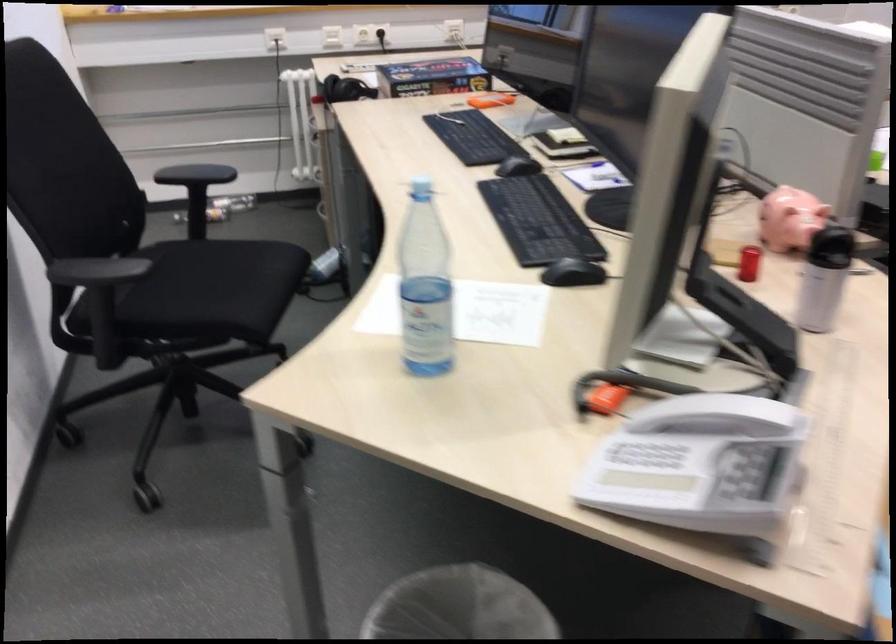
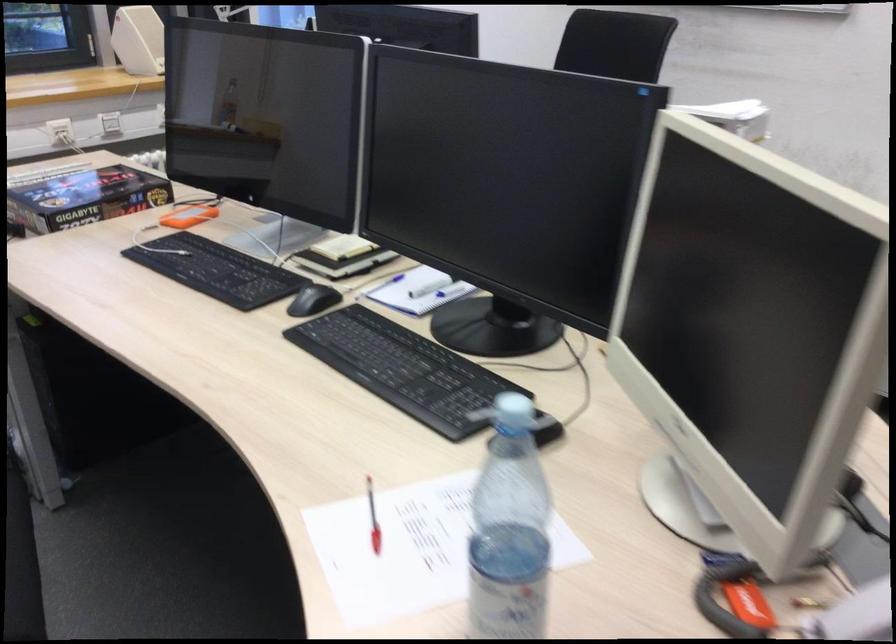
In the second image, find the point that corresponds to [486,97] in the first image.

(188, 216)